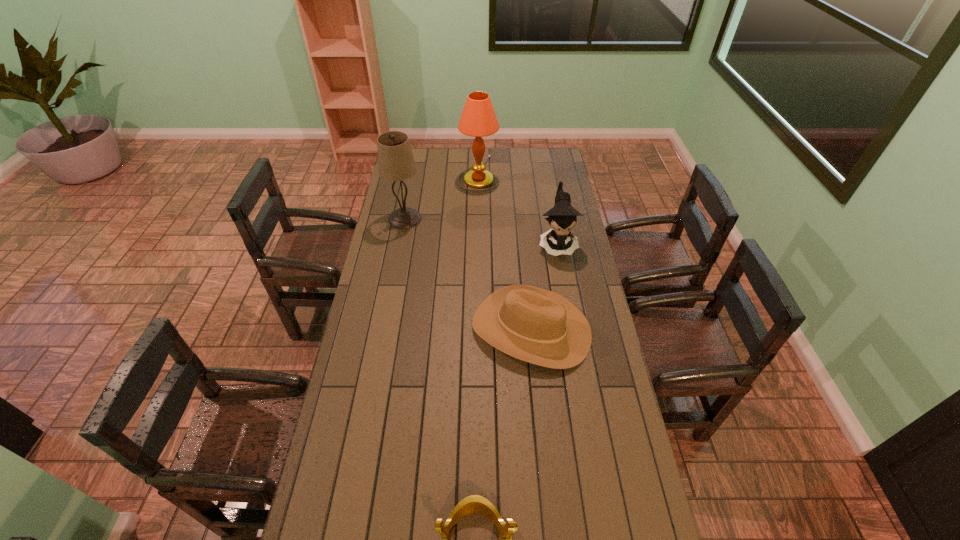
Identify the location of object located at the left edge. (396, 162).

Identify the location of doll that is at the right edge. (562, 217).

Locate an element on the screen. cowboy hat present at the right edge is located at coordinates (535, 325).

In the image, there is a desktop. Identify the location of vacant space at the far edge. This screenshot has height=540, width=960. (444, 157).

I want to click on vacant area at the left edge, so [x=396, y=238].

What are the coordinates of `free space at the right edge of the desktop` in the screenshot? It's located at (546, 187).

Image resolution: width=960 pixels, height=540 pixels. What are the coordinates of `free location at the far left corner of the desktop` in the screenshot? It's located at point(419,160).

At what (x,y) coordinates should I click in order to perform the action: click on free spot between the doll and the lampshade. Please return your answer as a coordinate pair (x, y). The width and height of the screenshot is (960, 540). Looking at the image, I should click on (481, 231).

Locate an element on the screen. Image resolution: width=960 pixels, height=540 pixels. empty space between the third tallest object and the second nearest object is located at coordinates (544, 286).

Find the location of a particular element. free space between the lamp and the lampshade is located at coordinates (442, 195).